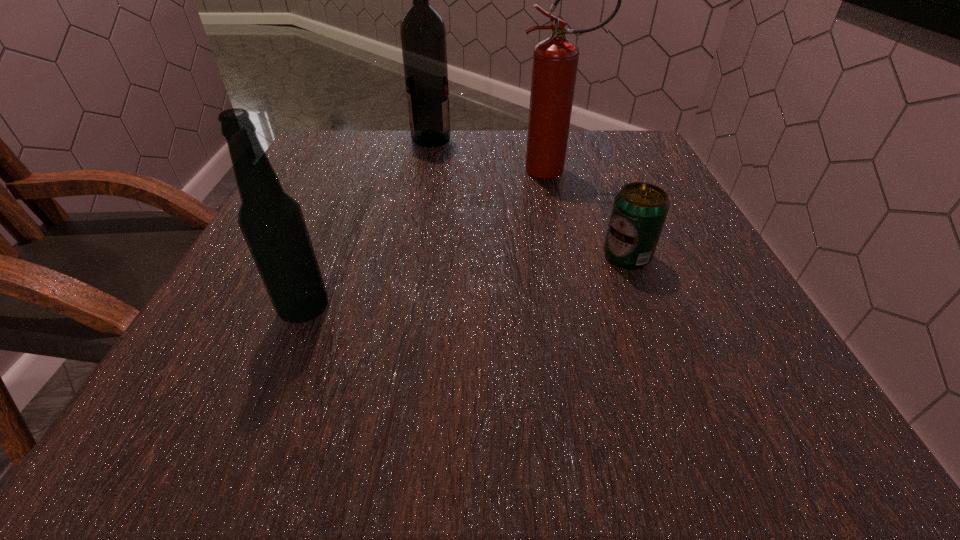
The image size is (960, 540). I want to click on blank space that satisfies the following two spatial constraints: 1. from the nozzle of the fire extinguisher; 2. on the back side of the beer can, so click(576, 256).

Find the location of a particular element. The width and height of the screenshot is (960, 540). vacant space that satisfies the following two spatial constraints: 1. on the front and back of the second object from left to right; 2. on the front side of the second shortest object is located at coordinates (399, 309).

At what (x,y) coordinates should I click in order to perform the action: click on vacant area in the image that satisfies the following two spatial constraints: 1. from the nozzle of the second nearest object; 2. on the right side of the third nearest object. Please return your answer as a coordinate pair (x, y). The width and height of the screenshot is (960, 540). Looking at the image, I should click on (576, 256).

The height and width of the screenshot is (540, 960). Find the location of `free space that satisfies the following two spatial constraints: 1. on the front and back of the farthest object; 2. on the back side of the shortest object`. free space that satisfies the following two spatial constraints: 1. on the front and back of the farthest object; 2. on the back side of the shortest object is located at coordinates (409, 256).

What are the coordinates of `vacant space that satisfies the following two spatial constraints: 1. on the front and back of the third object from right to left; 2. on the right side of the third farthest object` in the screenshot? It's located at (409, 256).

Where is `vacant space that satisfies the following two spatial constraints: 1. on the back side of the beer can; 2. from the nozzle of the fire extinguisher`? The image size is (960, 540). vacant space that satisfies the following two spatial constraints: 1. on the back side of the beer can; 2. from the nozzle of the fire extinguisher is located at coordinates (593, 171).